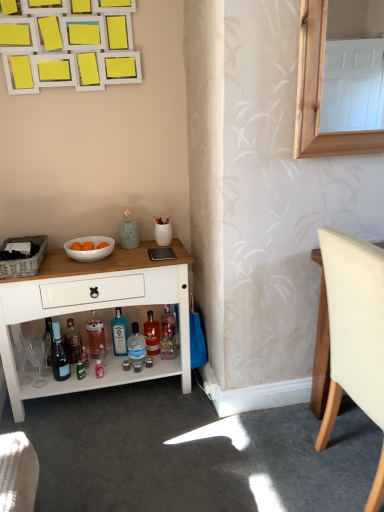
Locate an element on the screen. Image resolution: width=384 pixels, height=512 pixels. white wood cabinet at lower left is located at coordinates (96, 309).

How much space does translucent glass bottle at lower center, which is the fifth bottle from left to right, occupy vertically?

translucent glass bottle at lower center, which is the fifth bottle from left to right, is 9.54 inches tall.

What do you see at coordinates (24, 259) in the screenshot? Image resolution: width=384 pixels, height=512 pixels. I see `matte black picnic basket at left` at bounding box center [24, 259].

At what (x,y) coordinates should I click in order to perform the action: click on matte black picnic basket at left. Please return your answer as a coordinate pair (x, y). Looking at the image, I should click on (24, 259).

Where is `clear plastic bottle at lower center, the 4th bottle in the left-to-right sequence`? This screenshot has width=384, height=512. clear plastic bottle at lower center, the 4th bottle in the left-to-right sequence is located at coordinates (136, 347).

I want to click on white wood cabinet at lower left, so click(x=96, y=309).

From the image's perspective, is clear plastic bottle at lower center, which appears as the 2th bottle when viewed from the right, above white leather chair at right?

Actually, clear plastic bottle at lower center, which appears as the 2th bottle when viewed from the right, appears below white leather chair at right in the image.

Considering the sizes of clear plastic bottle at lower center, the 4th bottle in the left-to-right sequence, and white leather chair at right in the image, is clear plastic bottle at lower center, the 4th bottle in the left-to-right sequence, wider or thinner than white leather chair at right?

clear plastic bottle at lower center, the 4th bottle in the left-to-right sequence, is thinner than white leather chair at right.

Is clear plastic bottle at lower center, the 4th bottle in the left-to-right sequence, positioned with its back to white leather chair at right?

No, clear plastic bottle at lower center, the 4th bottle in the left-to-right sequence,'s orientation is not away from white leather chair at right.

From a real-world perspective, who is located lower, clear plastic bottle at lower center, which appears as the 2th bottle when viewed from the right, or white leather chair at right?

clear plastic bottle at lower center, which appears as the 2th bottle when viewed from the right.

Between matte black picnic basket at left and white wood cabinet at lower left, which one has larger size?

white wood cabinet at lower left is bigger.

From the image's perspective, does matte black picnic basket at left appear lower than white wood cabinet at lower left?

Incorrect, from the image's perspective, matte black picnic basket at left is higher than white wood cabinet at lower left.

Is matte black picnic basket at left inside or outside of white wood cabinet at lower left?

matte black picnic basket at left lies outside white wood cabinet at lower left.

Is translucent glass bottle at lower center, which is the fifth bottle from left to right, surrounding matte black picnic basket at left?

No, translucent glass bottle at lower center, which is the fifth bottle from left to right, does not contain matte black picnic basket at left.

From the image's perspective, which object appears higher, translucent glass bottle at lower center, the first bottle in the right-to-left sequence, or matte black picnic basket at left?

From the image's view, matte black picnic basket at left is above.

Which is in front, point (152, 320) or point (13, 262)?

The point (13, 262) is in front.

Is matte glass wine bottle at lower left inside the boundaries of shiny dark glass bottle at lower left, placed as the 1th bottle when sorted from left to right, or outside?

matte glass wine bottle at lower left cannot be found inside shiny dark glass bottle at lower left, placed as the 1th bottle when sorted from left to right.

How many degrees apart are the facing directions of matte glass wine bottle at lower left and shiny dark glass bottle at lower left, placed as the 1th bottle when sorted from left to right?

8.33 degrees separate the facing orientations of matte glass wine bottle at lower left and shiny dark glass bottle at lower left, placed as the 1th bottle when sorted from left to right.

Locate an element on the screen. The image size is (384, 512). wine bottle that appears above the shiny dark glass bottle at lower left, placed as the 1th bottle when sorted from left to right (from a real-world perspective) is located at coordinates (59, 355).

Does point (57, 338) appear closer or farther from the camera than point (69, 337)?

Clearly, point (57, 338) is closer to the camera than point (69, 337).

Which is more to the left, white wood cabinet at lower left or translucent glass bottle at lower center, which is the fifth bottle from left to right?

white wood cabinet at lower left is more to the left.

Considering the points (26, 304) and (152, 350), which point is in front, point (26, 304) or point (152, 350)?

The point (26, 304) is closer.

Is white wood cabinet at lower left wider than translucent glass bottle at lower center, the first bottle in the right-to-left sequence?

Indeed, white wood cabinet at lower left has a greater width compared to translucent glass bottle at lower center, the first bottle in the right-to-left sequence.

Is translucent glass bottle at lower center, the first bottle in the right-to-left sequence, inside or outside of translucent plastic bottle at lower center, positioned as the fourth bottle in right-to-left order?

translucent glass bottle at lower center, the first bottle in the right-to-left sequence, exists outside the volume of translucent plastic bottle at lower center, positioned as the fourth bottle in right-to-left order.

Looking at their sizes, would you say translucent glass bottle at lower center, the first bottle in the right-to-left sequence, is wider or thinner than translucent plastic bottle at lower center, which is the 2th bottle in left-to-right order?

A: In the image, translucent glass bottle at lower center, the first bottle in the right-to-left sequence, appears to be wider than translucent plastic bottle at lower center, which is the 2th bottle in left-to-right order.

What's the angular difference between translucent glass bottle at lower center, the first bottle in the right-to-left sequence, and translucent plastic bottle at lower center, positioned as the fourth bottle in right-to-left order,'s facing directions?

The angle between the facing direction of translucent glass bottle at lower center, the first bottle in the right-to-left sequence, and the facing direction of translucent plastic bottle at lower center, positioned as the fourth bottle in right-to-left order, is 5.57 degrees.

Based on the photo, can you confirm if translucent glass bottle at lower center, which is the fifth bottle from left to right, is smaller than translucent plastic bottle at lower center, positioned as the fourth bottle in right-to-left order?

Actually, translucent glass bottle at lower center, which is the fifth bottle from left to right, might be larger than translucent plastic bottle at lower center, positioned as the fourth bottle in right-to-left order.

Is translucent glass bottle at lower center, which is the fifth bottle from left to right, facing away from matte glass wine bottle at lower left?

No.

Is translucent glass bottle at lower center, the first bottle in the right-to-left sequence, surrounding matte glass wine bottle at lower left?

No.

From the image's perspective, does translucent glass bottle at lower center, the first bottle in the right-to-left sequence, appear higher than matte glass wine bottle at lower left?

Yes, from the image's perspective, translucent glass bottle at lower center, the first bottle in the right-to-left sequence, is on top of matte glass wine bottle at lower left.

How many degrees apart are the facing directions of translucent glass bottle at lower center, which is the fifth bottle from left to right, and matte glass wine bottle at lower left?

The facing directions of translucent glass bottle at lower center, which is the fifth bottle from left to right, and matte glass wine bottle at lower left are 12.8 degrees apart.

From a real-world perspective, starting from the white leather chair at right, which bottle is the 4th one below it? Please provide its 2D coordinates.

[(136, 347)]

Locate an element on the screen. This screenshot has width=384, height=512. picnic basket that is above the white wood cabinet at lower left (from the image's perspective) is located at coordinates (24, 259).

When comparing their distances from white glossy bowl at center, does clear plastic bottle at lower center, the 4th bottle in the left-to-right sequence, or matte black picnic basket at left seem closer?

matte black picnic basket at left.

From the image, which object appears to be farther from shiny dark glass bottle at lower left, placed as the 1th bottle when sorted from left to right, matte black picnic basket at left or clear plastic bottle at lower center, which appears as the 2th bottle when viewed from the right?

Based on the image, matte black picnic basket at left appears to be further to shiny dark glass bottle at lower left, placed as the 1th bottle when sorted from left to right.

From the image, which object appears to be nearer to clear plastic bottle at lower center, which appears as the 2th bottle when viewed from the right, matte glass wine bottle at lower left or white wood cabinet at lower left?

matte glass wine bottle at lower left.

Consider the image. When comparing their distances from white glossy bowl at center, does white wood cabinet at lower left or shiny dark glass bottle at lower left, placed as the 1th bottle when sorted from left to right, seem closer?

white wood cabinet at lower left is positioned closer to the anchor white glossy bowl at center.

Estimate the real-world distances between objects in this image. Which object is further from matte glass wine bottle at lower left, matte black picnic basket at left or translucent plastic bottle at lower center, positioned as the fourth bottle in right-to-left order?

Based on the image, matte black picnic basket at left appears to be further to matte glass wine bottle at lower left.

From the image, which object appears to be farther from shiny dark glass bottle at lower left, arranged as the 5th bottle when viewed from the right, translucent plastic bottle at lower center, which is the 2th bottle in left-to-right order, or clear plastic bottle at lower center, the 4th bottle in the left-to-right sequence?

The object further to shiny dark glass bottle at lower left, arranged as the 5th bottle when viewed from the right, is clear plastic bottle at lower center, the 4th bottle in the left-to-right sequence.

Looking at the image, which one is located closer to white leather chair at right, matte glass wine bottle at lower left or blue glass bottle at center, the third bottle in the right-to-left sequence?

Based on the image, blue glass bottle at center, the third bottle in the right-to-left sequence, appears to be nearer to white leather chair at right.

Based on the photo, when comparing their distances from white glossy bowl at center, does shiny dark glass bottle at lower left, placed as the 1th bottle when sorted from left to right, or blue glass bottle at center, the 3th bottle when ordered from left to right, seem further?

shiny dark glass bottle at lower left, placed as the 1th bottle when sorted from left to right.

Locate an element on the screen. The height and width of the screenshot is (512, 384). desk between white glossy bowl at center and blue glass bottle at center, the 3th bottle when ordered from left to right, in the vertical direction is located at coordinates (96, 309).

What are the coordinates of `wine bottle between white wood cabinet at lower left and translucent plastic bottle at lower center, positioned as the fourth bottle in right-to-left order, from front to back` in the screenshot? It's located at (59, 355).

Find the location of a particular element. This screenshot has width=384, height=512. desk that lies between white glossy bowl at center and translucent plastic bottle at lower center, positioned as the fourth bottle in right-to-left order, from top to bottom is located at coordinates (96, 309).

The height and width of the screenshot is (512, 384). Identify the location of wine bottle between matte black picnic basket at left and clear plastic bottle at lower center, which appears as the 2th bottle when viewed from the right, vertically. (59, 355).